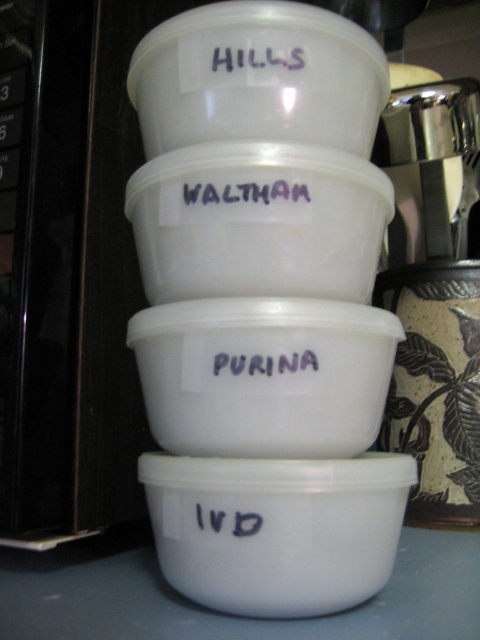
You are arranging items on a kitchen counter and need to place a new bowl exactly where the white matte bowl at center was. According to the image, what are the coordinates of the location where you should place the new bowl?

The coordinates for the white matte bowl at center are at point (264,376). You should place the new bowl at those coordinates.

You are organizing a pantry and need to place a white matte bowl at center and a black matte text at center on a shelf. Which object requires a wider space on the shelf?

The white matte bowl at center requires a wider space on the shelf since its width surpasses the black matte text at center.

Looking at this image, you are standing in a kitchen and see the white plastic containers stacked vertically on the countertop. There is a point marked at coordinates (x=264, y=376). What object is located at this point?

The point (x=264, y=376) corresponds to the white matte bowl at center.